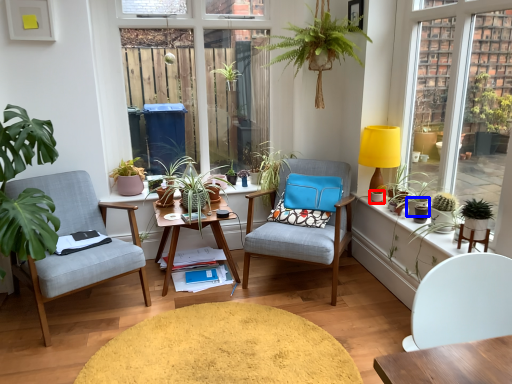
Question: Which object is further to the camera taking this photo, flowerpot (highlighted by a red box) or flowerpot (highlighted by a blue box)?

Choices:
 (A) flowerpot
 (B) flowerpot

Answer: (A)